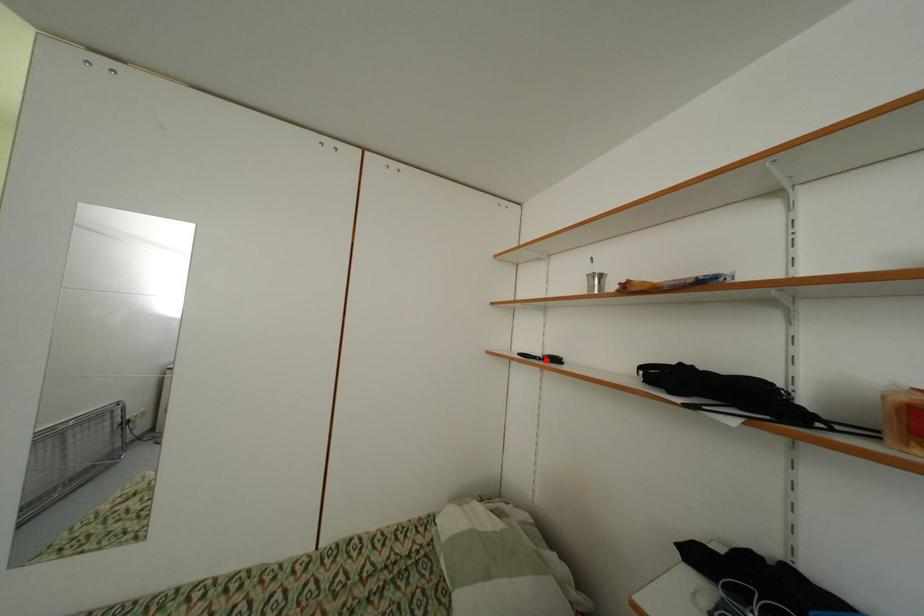
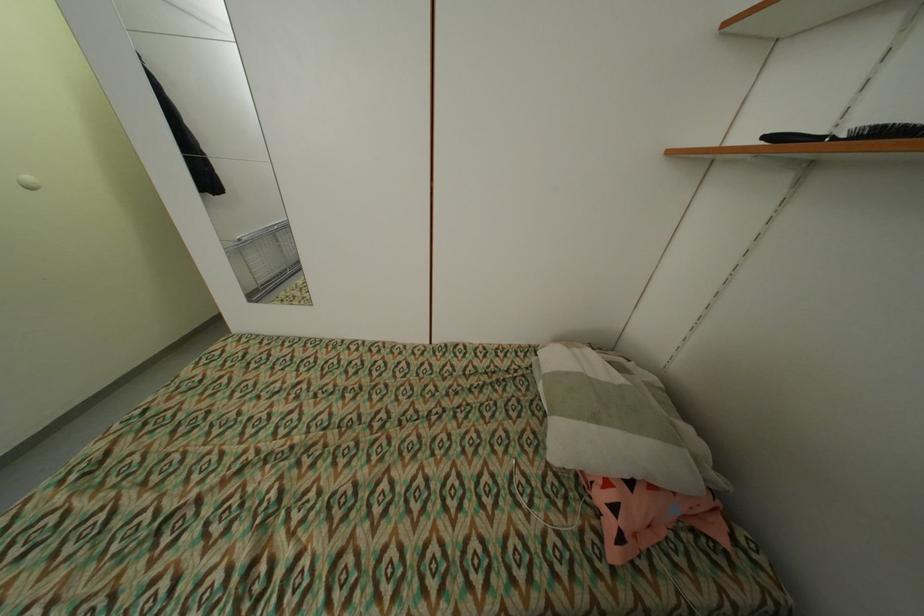
Where in the second image is the point corresponding to the highlighted location from the first image?

(841, 140)